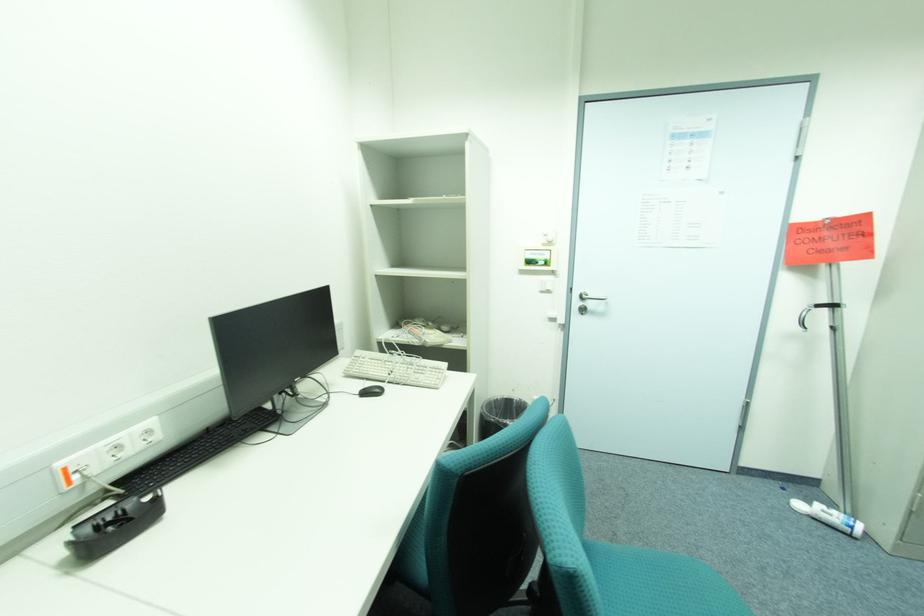
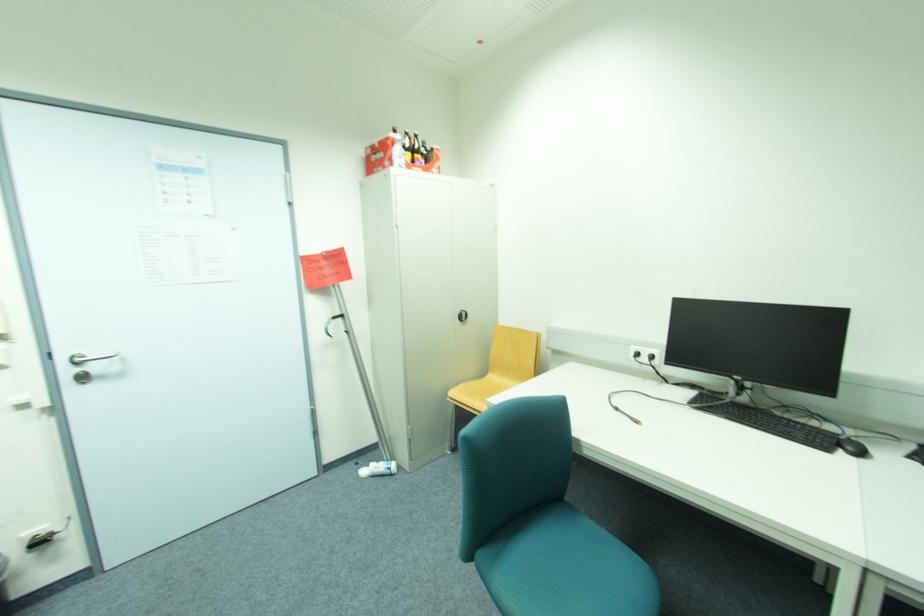
Where in the second image is the point corresponding to (816,503) from the first image?

(373, 468)